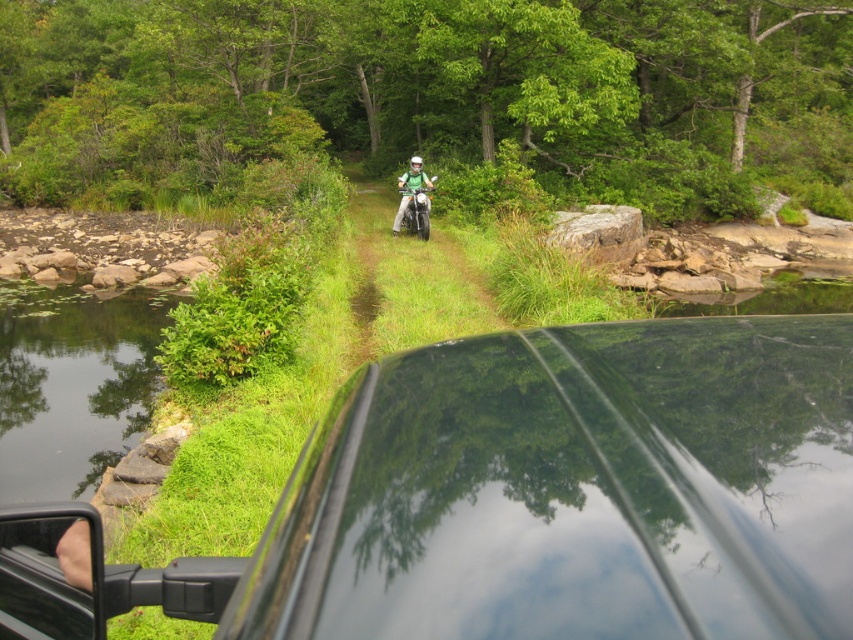
Measure the distance between point (662, 428) and camera.

The distance of point (662, 428) from camera is 3.73 feet.

Does glossy black car at center come behind green matte motorcycle at center?

That is False.

Which is behind, point (851, 588) or point (422, 236)?

Point (422, 236)

Locate an element on the screen. This screenshot has width=853, height=640. glossy black car at center is located at coordinates (556, 493).